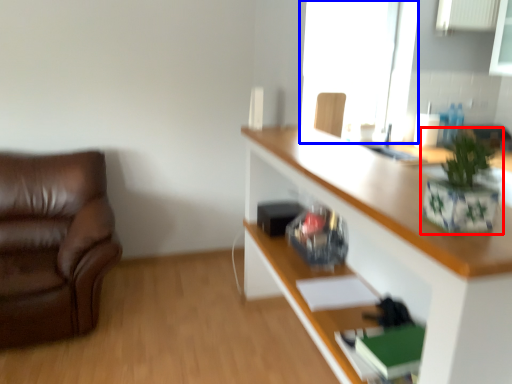
Question: Which point is further to the camera, houseplant (highlighted by a red box) or window (highlighted by a blue box)?

Choices:
 (A) houseplant
 (B) window

Answer: (B)